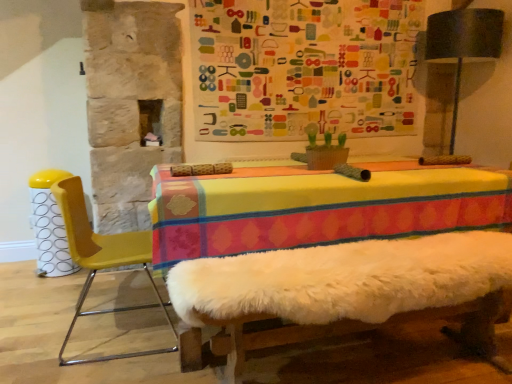
Question: Is white fluffy bed frame at center wider or thinner than yellow plastic chair at left?

Choices:
 (A) thin
 (B) wide

Answer: (B)

Question: From their relative heights in the image, would you say white fluffy bed frame at center is taller or shorter than yellow plastic chair at left?

Choices:
 (A) tall
 (B) short

Answer: (B)

Question: Based on their relative distances, which object is farther from the yellow plastic chair at left?

Choices:
 (A) yellow plastic bar stool at left
 (B) white fluffy bed frame at center
 (C) multicolored fabric bulletin board at upper center

Answer: (C)

Question: Which object is the closest to the multicolored fabric bulletin board at upper center?

Choices:
 (A) yellow plastic bar stool at left
 (B) yellow plastic chair at left
 (C) white fluffy bed frame at center

Answer: (C)